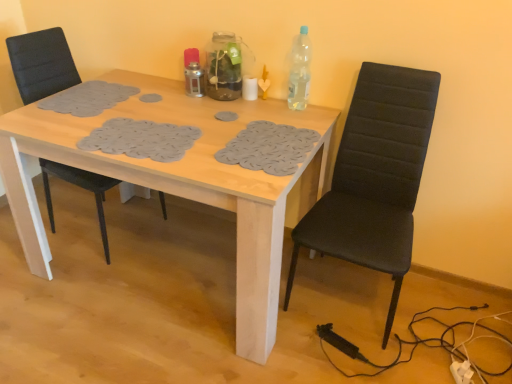
Find the location of a particular element. vacant space underneath light wood table at center (from a real-world perspective) is located at coordinates (177, 261).